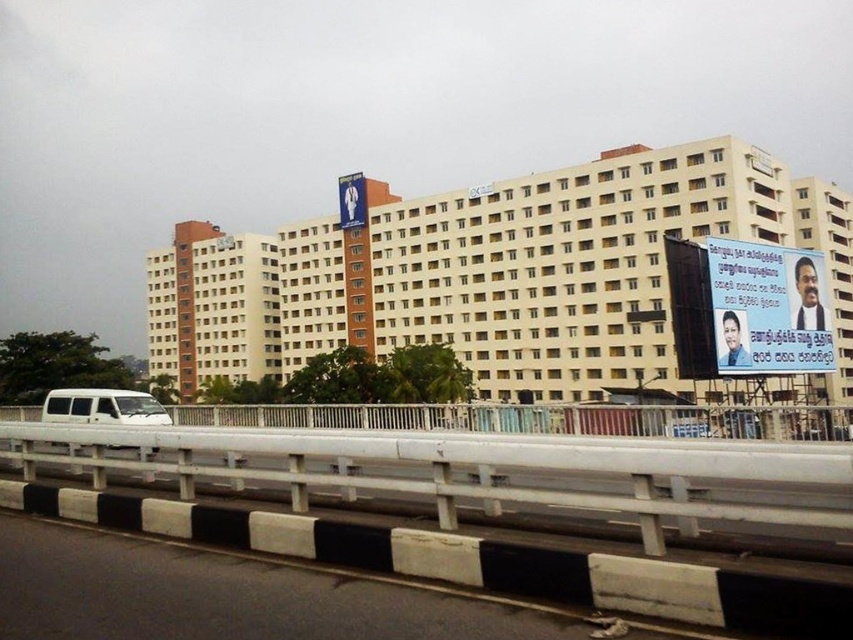
Does beige concrete building at center have a larger size compared to white matte van at lower left?

Correct, beige concrete building at center is larger in size than white matte van at lower left.

Does beige concrete building at center appear under white matte van at lower left?

Yes, beige concrete building at center is below white matte van at lower left.

What do you see at coordinates (502, 278) in the screenshot? I see `beige concrete building at center` at bounding box center [502, 278].

Locate an element on the screen. beige concrete building at center is located at coordinates (502, 278).

Does beige concrete building at center appear over white glossy signboard at upper center?

No, beige concrete building at center is not above white glossy signboard at upper center.

Which is more to the right, beige concrete building at center or white glossy signboard at upper center?

white glossy signboard at upper center

Is point (671, 150) behind point (349, 225)?

No, (671, 150) is in front of (349, 225).

Identify the location of beige concrete building at center. (502, 278).

Is the position of blue glossy poster at upper right less distant than that of white glossy signboard at upper center?

Yes, it is.

Looking at this image, is blue glossy poster at upper right further to the viewer compared to white glossy signboard at upper center?

No, it is in front of white glossy signboard at upper center.

Identify the location of blue glossy poster at upper right. Image resolution: width=853 pixels, height=640 pixels. (769, 308).